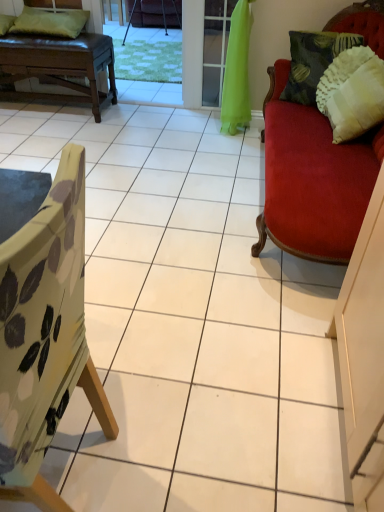
Question: Is metallic tripod at center, the first chair from the back, to the left or to the right of green fabric screen door at center in the image?

Choices:
 (A) left
 (B) right

Answer: (A)

Question: Is point (132, 12) closer or farther from the camera than point (220, 70)?

Choices:
 (A) closer
 (B) farther

Answer: (B)

Question: Considering the real-world distances, which object is farthest from the white textured pillow at upper right, the third pillow positioned from the left?

Choices:
 (A) green fabric pillow at upper left, which ranks as the 1th pillow in left-to-right order
 (B) floral fabric chair at left, the 2th chair from the back
 (C) metallic tripod at center, the first chair positioned from the top
 (D) dark green textured pillow at upper right, the second pillow positioned from the right
 (E) green fabric screen door at center

Answer: (C)

Question: Estimate the real-world distances between objects in this image. Which object is farther from the white textured pillow at upper right, the third pillow positioned from the left?

Choices:
 (A) dark green textured pillow at upper right, the second pillow positioned from the left
 (B) brown leather bench at upper left
 (C) green fabric screen door at center
 (D) green fabric pillow at upper left, which is counted as the 3th pillow, starting from the right
 (E) floral fabric chair at left, the first chair positioned from the front

Answer: (D)